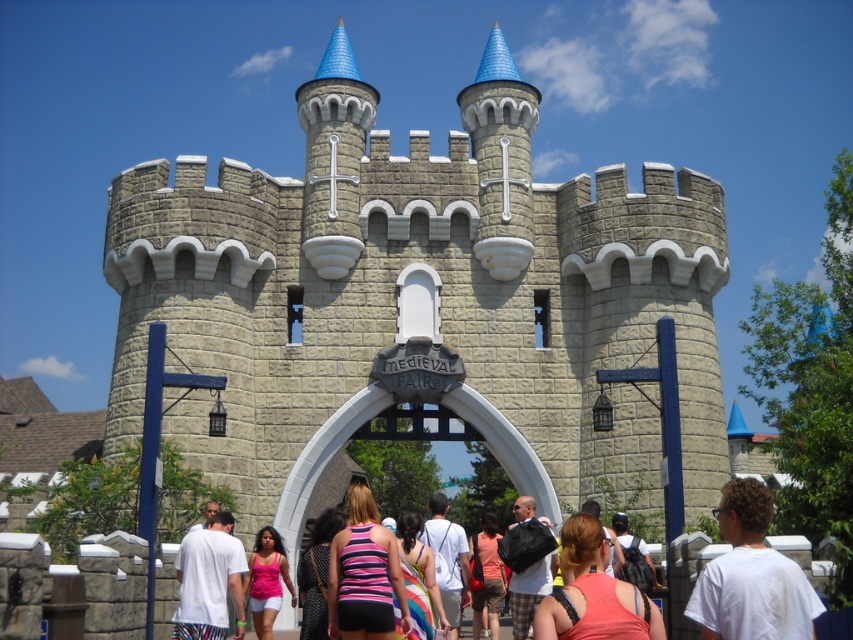
Question: Considering the real-world distances, which object is farthest from the striped fabric dress at center?

Choices:
 (A) polka dot dress at center
 (B) matte black backpack at center
 (C) pink fabric tank top at center
 (D) white matte t-shirt at center

Answer: (D)

Question: Can you confirm if polka dot dress at center is thinner than matte black backpack at center?

Choices:
 (A) no
 (B) yes

Answer: (A)

Question: Is pink striped tank top at center further to the viewer compared to striped fabric tank top at center?

Choices:
 (A) yes
 (B) no

Answer: (B)

Question: Which of the following is the farthest from the observer?

Choices:
 (A) (762, 618)
 (B) (647, 625)

Answer: (B)

Question: Which of these objects is positioned farthest from the pink fabric tank top at center?

Choices:
 (A) matte pink tank top at center
 (B) light gray stone castle at center

Answer: (B)

Question: Can you confirm if white matte t-shirt at center is positioned below striped fabric tank top at center?

Choices:
 (A) yes
 (B) no

Answer: (B)